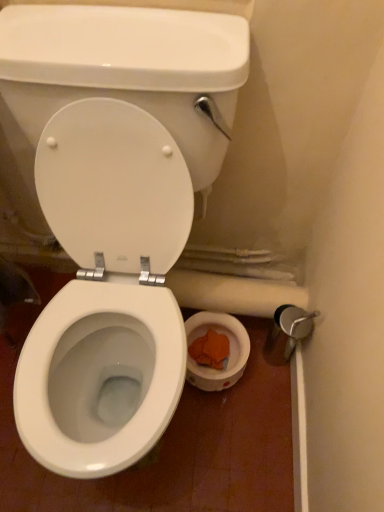
Where is `white glossy toilet at center`? white glossy toilet at center is located at coordinates (106, 292).

The width and height of the screenshot is (384, 512). Describe the element at coordinates (106, 292) in the screenshot. I see `white glossy toilet at center` at that location.

Measure the distance between white glossy toilet at center and camera.

white glossy toilet at center and camera are 31.39 inches apart from each other.

I want to click on white glossy toilet at center, so click(106, 292).